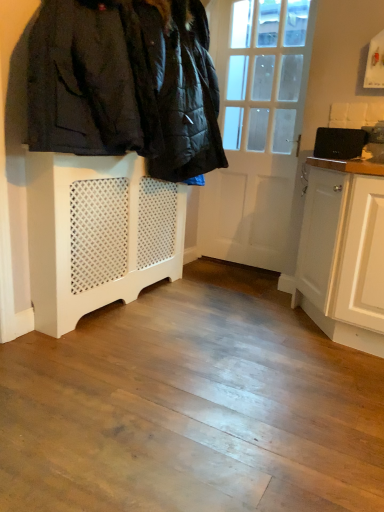
This screenshot has width=384, height=512. Identify the location of free location in front of white painted wood radiator at lower left. (136, 354).